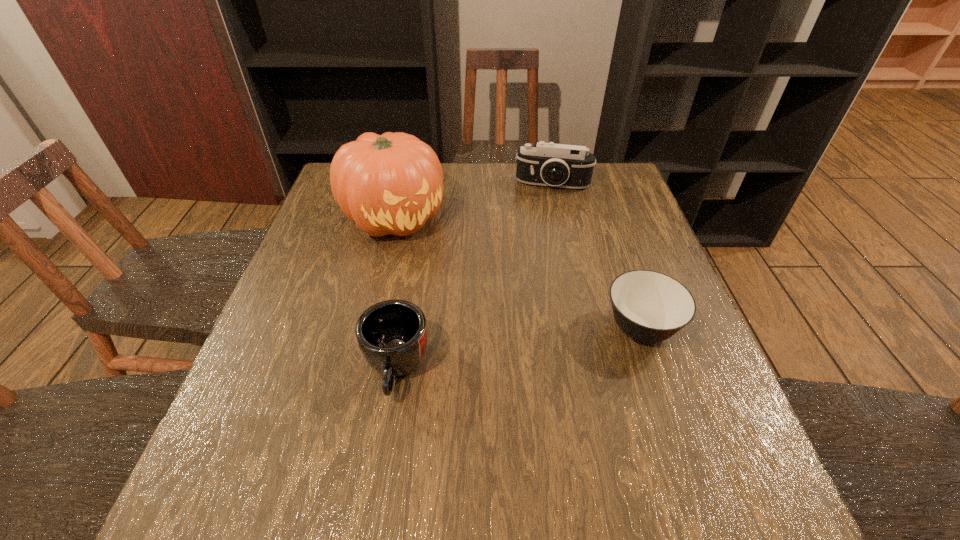
Locate an element on the screen. The height and width of the screenshot is (540, 960). unoccupied position between the mug and the camera is located at coordinates (474, 276).

Where is `free space that is in between the mug and the camera`? Image resolution: width=960 pixels, height=540 pixels. free space that is in between the mug and the camera is located at coordinates (474, 276).

At what (x,y) coordinates should I click in order to perform the action: click on empty space between the camera and the pumpkin. Please return your answer as a coordinate pair (x, y). This screenshot has width=960, height=540. Looking at the image, I should click on coord(473,201).

This screenshot has width=960, height=540. I want to click on vacant space that's between the soup bowl and the second tallest object, so (x=597, y=256).

This screenshot has height=540, width=960. Identify the location of empty location between the pumpkin and the shortest object. (517, 273).

Locate an element on the screen. The height and width of the screenshot is (540, 960). vacant region between the second tallest object and the soup bowl is located at coordinates (597, 256).

Image resolution: width=960 pixels, height=540 pixels. I want to click on blank region between the pumpkin and the mug, so click(395, 293).

Image resolution: width=960 pixels, height=540 pixels. In order to click on the second closest object to the second tallest object in this screenshot , I will do `click(649, 306)`.

Find the location of a particular element. the closest object to the mug is located at coordinates (392, 183).